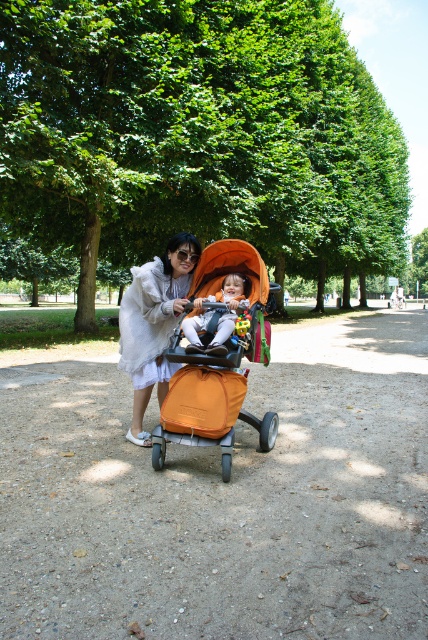
Question: Does orange fabric baby carriage at center appear over soft orange stroller at center?

Choices:
 (A) yes
 (B) no

Answer: (B)

Question: Which point is farther to the camera?

Choices:
 (A) soft orange stroller at center
 (B) white fluffy coat at center

Answer: (B)

Question: Does orange fabric baby carriage at center lie in front of soft orange stroller at center?

Choices:
 (A) no
 (B) yes

Answer: (B)

Question: Is white fluffy coat at center in front of soft orange stroller at center?

Choices:
 (A) yes
 (B) no

Answer: (B)

Question: Which of the following is the closest to the observer?

Choices:
 (A) pyautogui.click(x=154, y=278)
 (B) pyautogui.click(x=208, y=433)

Answer: (B)

Question: Which object appears farthest from the camera in this image?

Choices:
 (A) orange fabric baby carriage at center
 (B) white fluffy coat at center
 (C) soft orange stroller at center

Answer: (B)